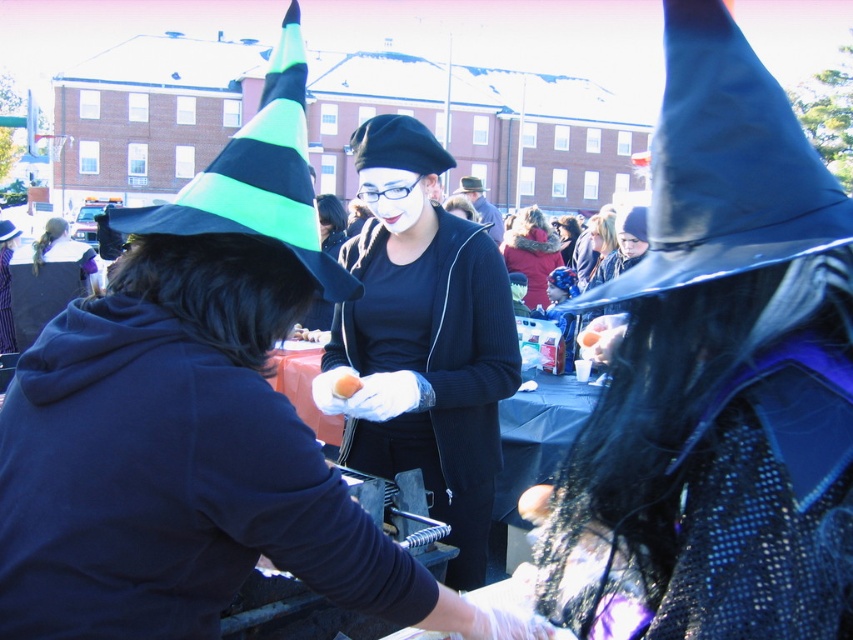
Question: Can you confirm if matte black hoodie at center is positioned to the left of orange matte egg at center?

Choices:
 (A) no
 (B) yes

Answer: (B)

Question: Which of the following is the farthest from the observer?

Choices:
 (A) (596, 212)
 (B) (97, 305)
 (C) (596, 337)

Answer: (A)

Question: Which point is farther to the camera?

Choices:
 (A) velvet red coat at center
 (B) matte black hoodie at center

Answer: (A)

Question: Which point is farther to the camera?

Choices:
 (A) velvet red coat at center
 (B) matte black wig at center
 (C) matte black clown nose at center

Answer: (A)

Question: Does matte black clown nose at center appear on the left side of neon green/black striped witch hat at left?

Choices:
 (A) yes
 (B) no

Answer: (B)

Question: Can you confirm if matte black hoodie at center is positioned to the left of velvet red coat at center?

Choices:
 (A) yes
 (B) no

Answer: (A)